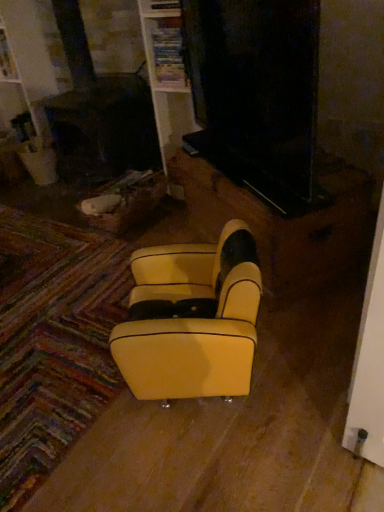
Image resolution: width=384 pixels, height=512 pixels. Find the location of `vacant space to the right of yellow leather/velvet rocking chair at center`. vacant space to the right of yellow leather/velvet rocking chair at center is located at coordinates [x=302, y=350].